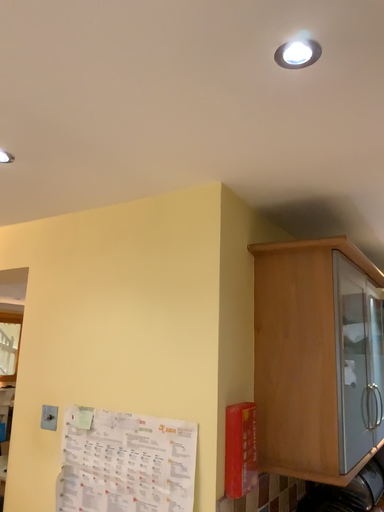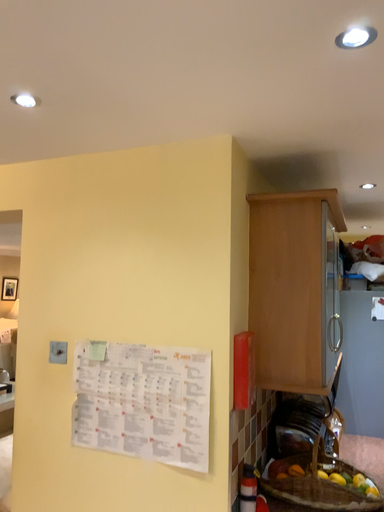
Question: Which way did the camera rotate in the video?

Choices:
 (A) rotated right
 (B) rotated left

Answer: (A)